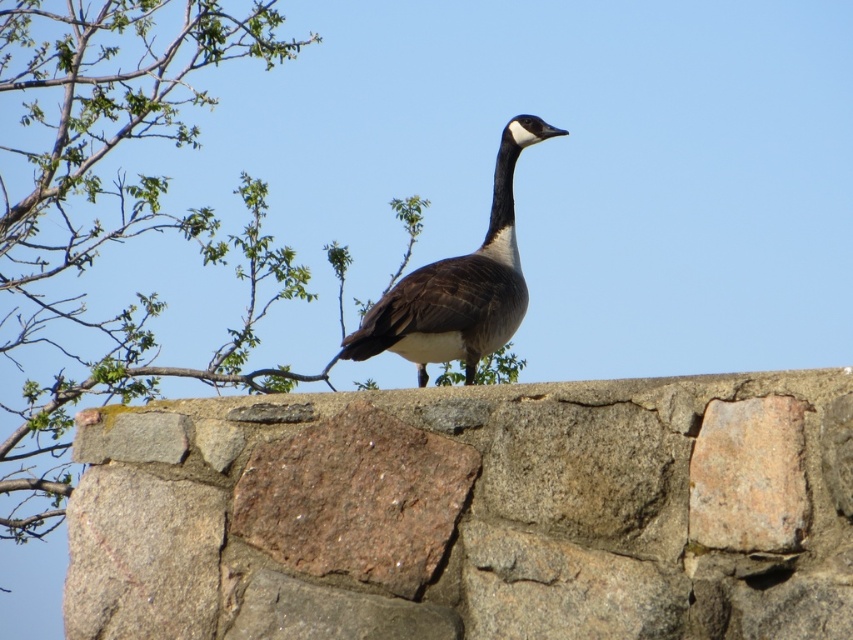
Question: Observing the image, what is the correct spatial positioning of brown rough stone at center in reference to dark brown feathered goose at center?

Choices:
 (A) right
 (B) left

Answer: (B)

Question: Is brown rough stone at center below green leafy branches at upper left?

Choices:
 (A) no
 (B) yes

Answer: (B)

Question: Which point appears farthest from the camera in this image?

Choices:
 (A) (221, 28)
 (B) (519, 116)

Answer: (A)

Question: Does brown rough stone at center lie behind dark brown feathered goose at center?

Choices:
 (A) no
 (B) yes

Answer: (A)

Question: Among these objects, which one is farthest from the camera?

Choices:
 (A) brown rough stone at center
 (B) green leafy branches at upper left

Answer: (B)

Question: Among these objects, which one is nearest to the camera?

Choices:
 (A) brown rough stone at center
 (B) dark brown feathered goose at center
 (C) green leafy branches at upper left

Answer: (A)